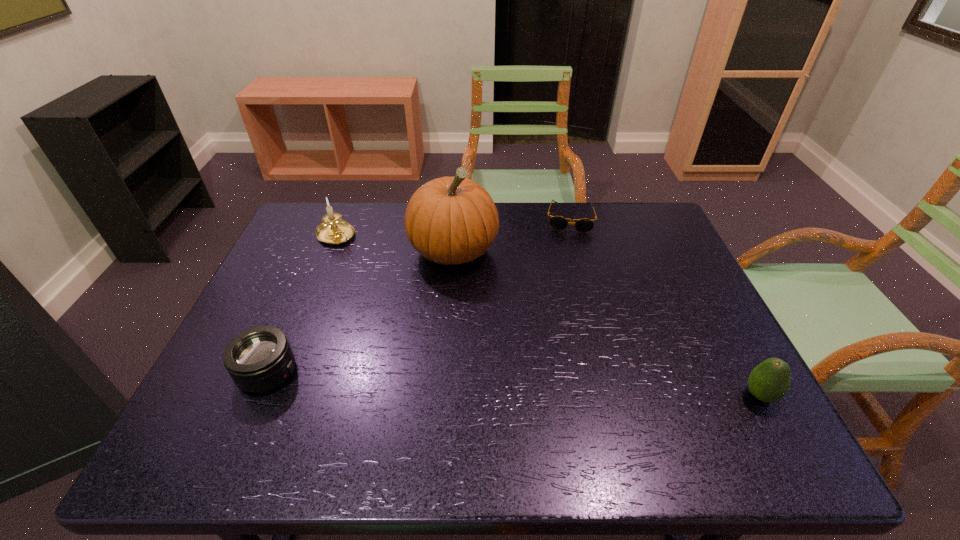
This screenshot has width=960, height=540. I want to click on vacant space on the desktop that is between the second shortest object and the third shortest object and is positioned on the stem of the tallest object, so click(x=491, y=383).

Image resolution: width=960 pixels, height=540 pixels. What are the coordinates of `vacant space on the desktop that is between the fourth tallest object and the rightmost object and is positioned on the lenses of the fourth object from left to right` in the screenshot? It's located at (564, 386).

Find the location of a particular element. The height and width of the screenshot is (540, 960). vacant space on the desktop that is between the telephoto lens and the rightmost object and is positioned on the handle side of the candle holder is located at coordinates pyautogui.click(x=495, y=383).